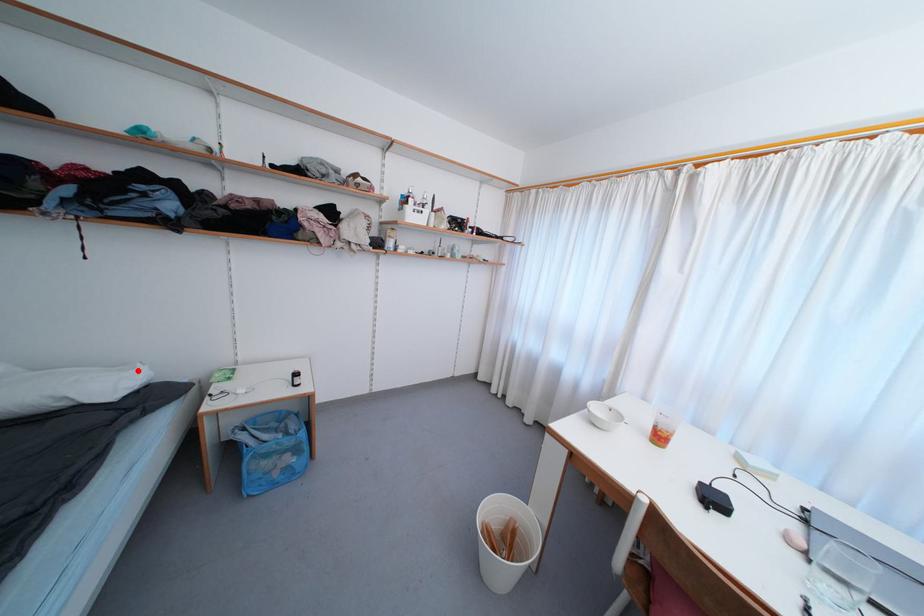
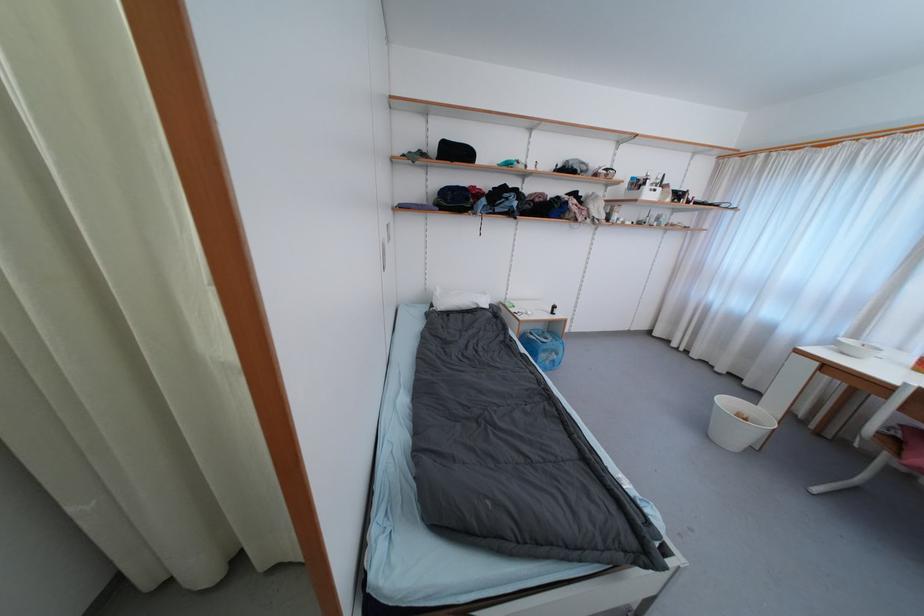
In the second image, find the point that corresponds to the highlighted location in the first image.

(489, 296)